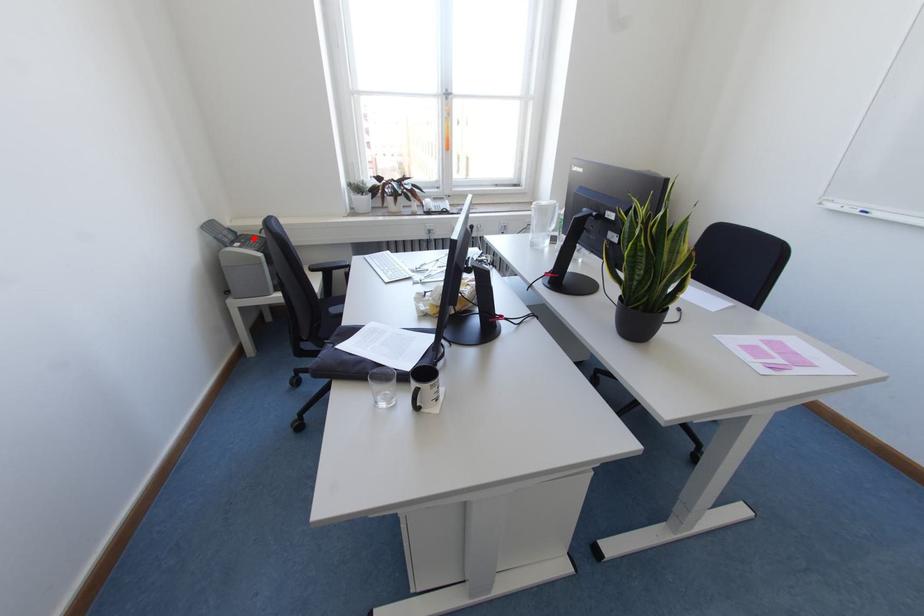
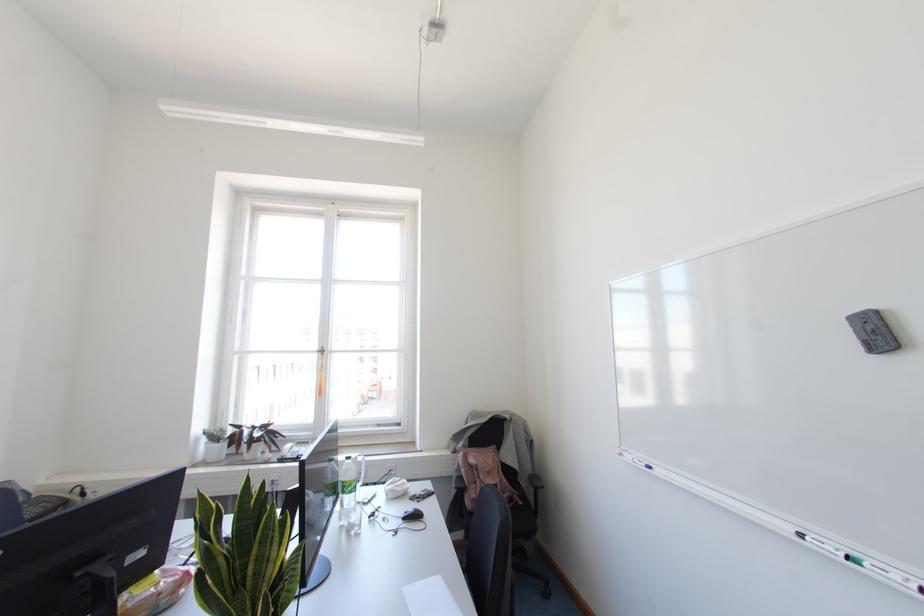
Question: I am providing you with two images of the same scene from different viewpoints. Image1 has a red point marked. In image2, the corresponding 3D location appears at what relative position? Reply with the corresponding letter.

Choices:
 (A) Closer
 (B) Farther

Answer: (B)